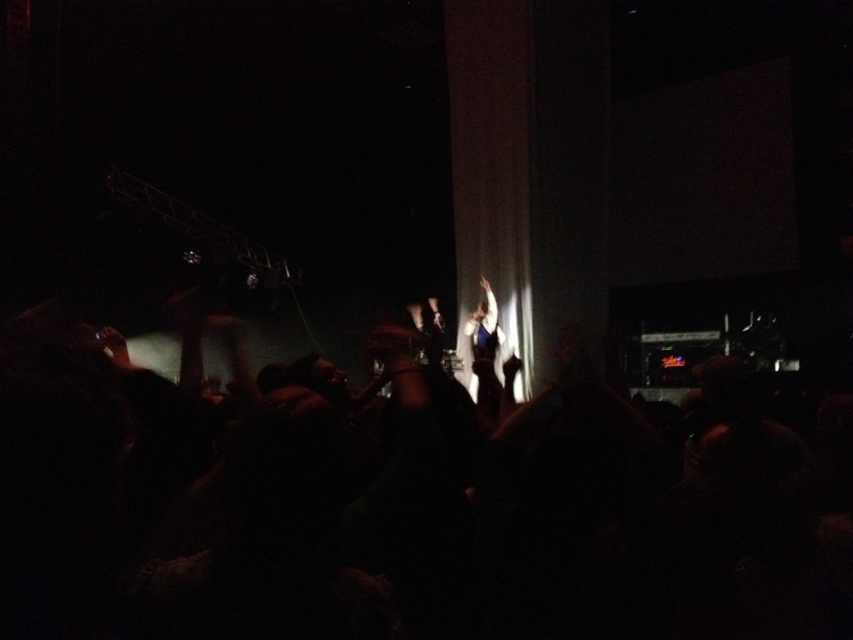
Question: Considering the relative positions of black fabric crowd at center and shiny blue dress at center in the image provided, where is black fabric crowd at center located with respect to shiny blue dress at center?

Choices:
 (A) right
 (B) left

Answer: (B)

Question: Is black fabric crowd at center smaller than shiny blue dress at center?

Choices:
 (A) yes
 (B) no

Answer: (B)

Question: In this image, where is black fabric crowd at center located relative to shiny blue dress at center?

Choices:
 (A) left
 (B) right

Answer: (A)

Question: Among these objects, which one is nearest to the camera?

Choices:
 (A) black fabric crowd at center
 (B) shiny blue dress at center

Answer: (A)